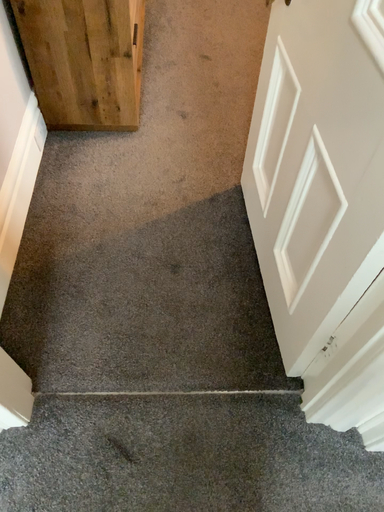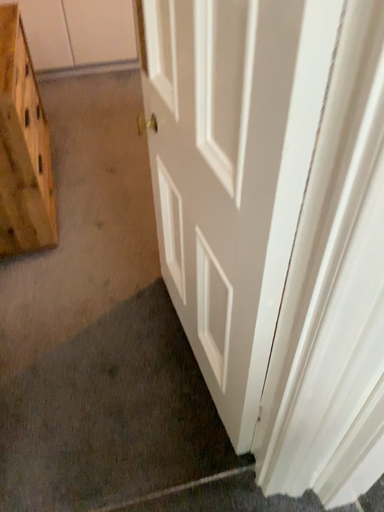
Question: How did the camera likely rotate when shooting the video?

Choices:
 (A) rotated upward
 (B) rotated downward

Answer: (A)